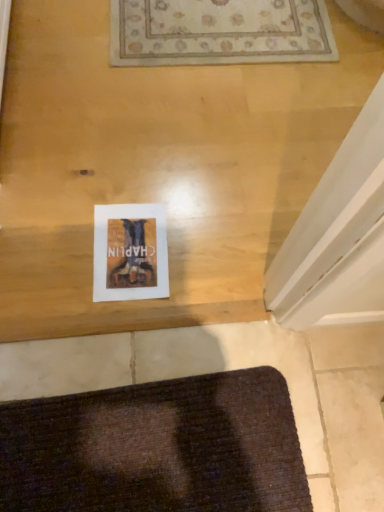
Identify the location of free region under dark brown textured mat at lower left (from a real-world perspective). (146, 449).